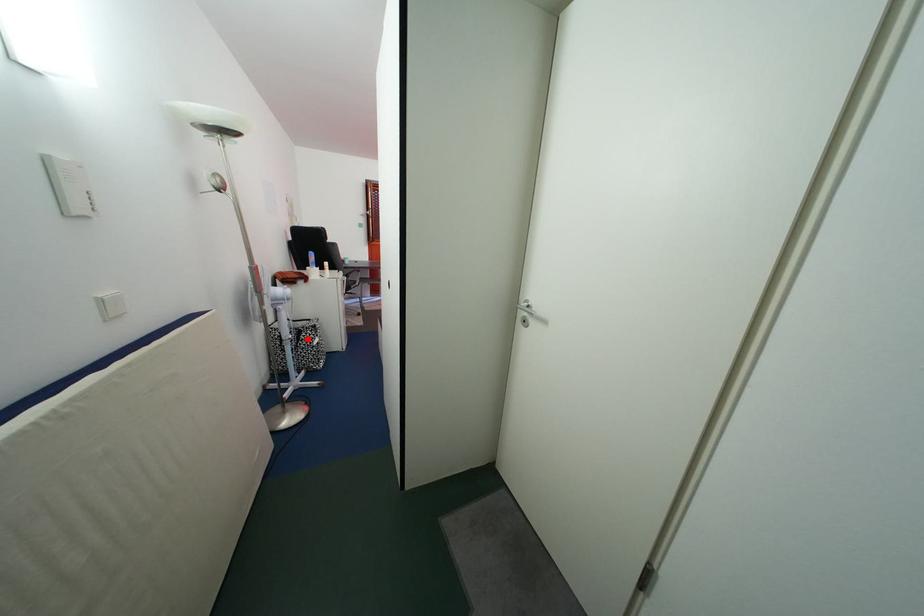
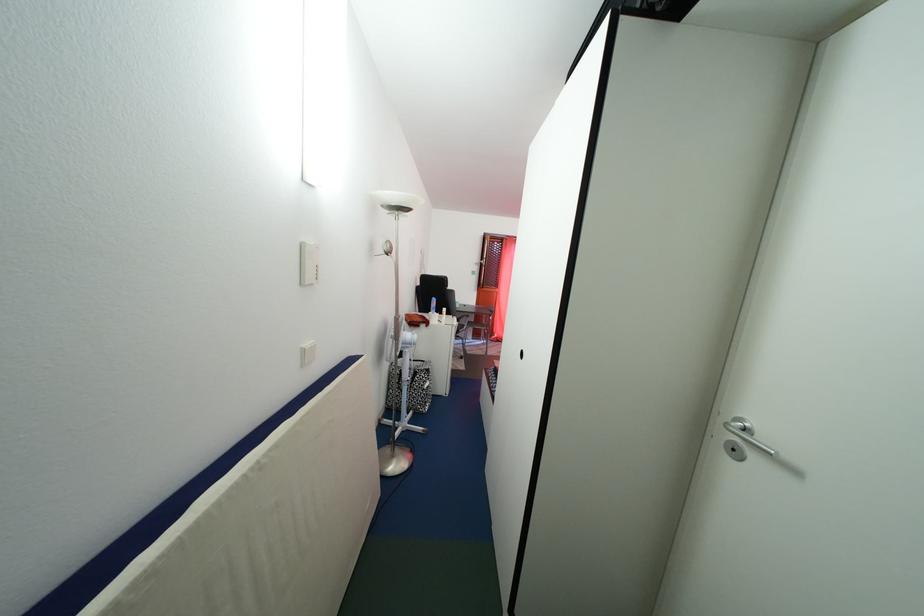
Question: I am providing you with two images of the same scene from different viewpoints. A red point is marked on the first image. At the location where the point appears in image 1, is it still visible in image 2?

Choices:
 (A) Yes
 (B) No

Answer: (A)